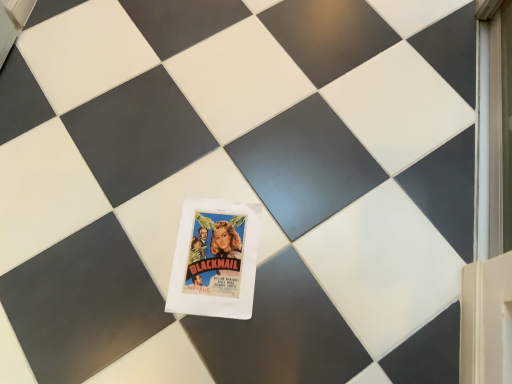
Locate an element on the screen. The width and height of the screenshot is (512, 384). free point in front of matte paper poster at center is located at coordinates (208, 344).